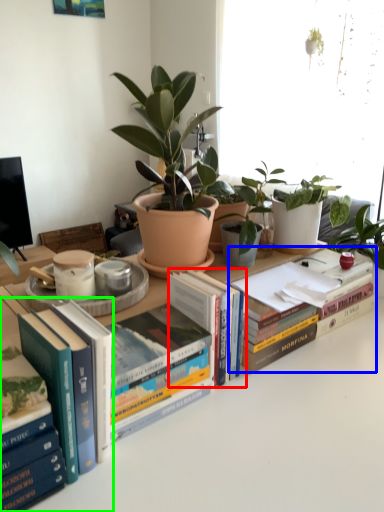
Question: Which object is positioned closest to book (highlighted by a red box)? Select from book (highlighted by a blue box) and book (highlighted by a green box).

Choices:
 (A) book
 (B) book

Answer: (A)